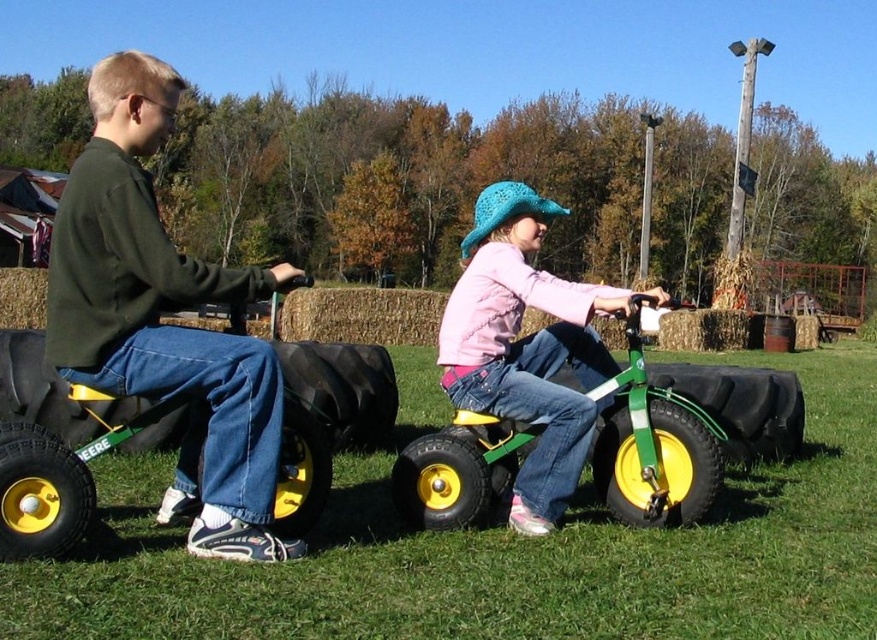
You are a parent trying to locate your child who is wearing a pink matte jacket at center and is near a rubberized green wagon at left. Based on the scene description, which direction should you look relative to the wagon to find the jacket?

The pink matte jacket at center is positioned on the right side of the rubberized green wagon at left, so you should look to the right of the wagon to find the jacket.